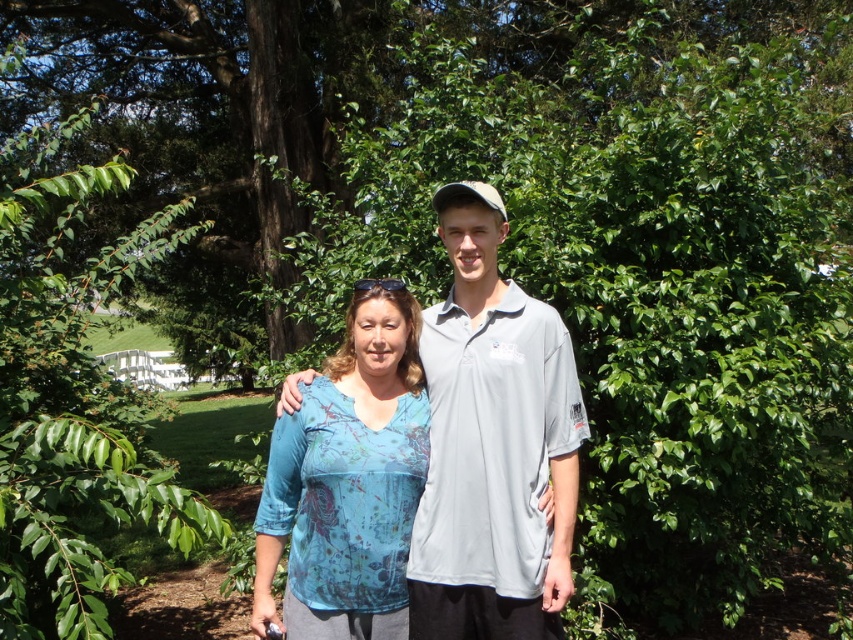
Question: Which point appears farthest from the camera in this image?

Choices:
 (A) (393, 397)
 (B) (450, 243)

Answer: (A)

Question: Which point appears farthest from the camera in this image?

Choices:
 (A) (268, 467)
 (B) (486, 600)

Answer: (A)

Question: Can you confirm if blue printed shirt at center is positioned to the right of blue printed blouse at center?

Choices:
 (A) yes
 (B) no

Answer: (A)

Question: Among these points, which one is farthest from the camera?

Choices:
 (A) (337, 605)
 (B) (15, 304)

Answer: (B)

Question: Can you confirm if blue printed shirt at center is positioned to the left of blue printed blouse at center?

Choices:
 (A) no
 (B) yes

Answer: (A)

Question: Is green leafy tree at upper left wider than blue printed blouse at center?

Choices:
 (A) no
 (B) yes

Answer: (A)